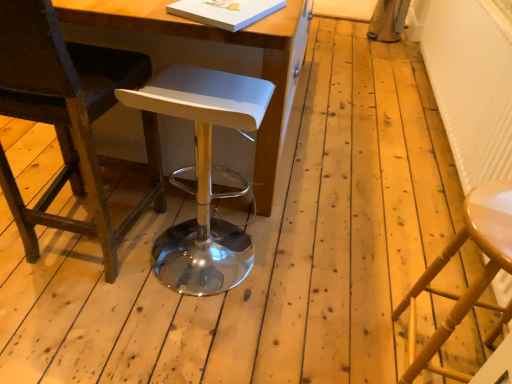
The width and height of the screenshot is (512, 384). I want to click on free area in between white plastic stool at center, marked as the first stool in a left-to-right arrangement, and white textured radiator at right, so click(x=351, y=187).